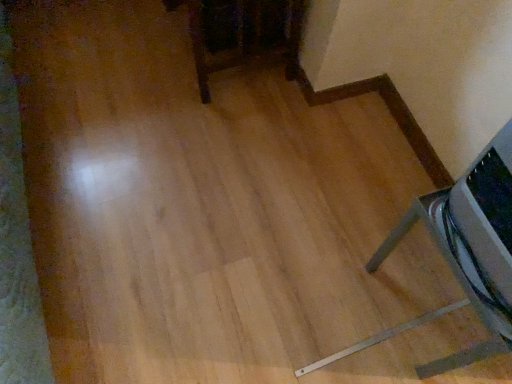
The height and width of the screenshot is (384, 512). I want to click on free space to the left of dark wood table at upper center, which is the second furniture in bottom-to-top order, so click(x=102, y=51).